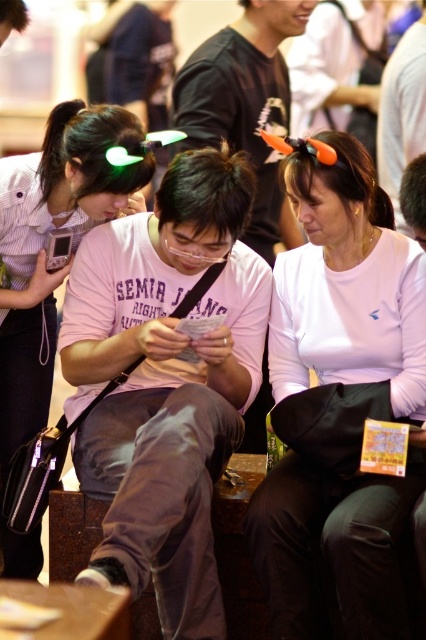
You are a photographer taking a picture of the scene. You notice two points in the image at coordinates point (425, 292) and point (97, 148). Which point is closer to the camera?

Point (97, 148) is closer to the camera because the description states that point (425, 292) is further away from the camera than point (97, 148).

You are a photographer trying to capture a clear shot of the matte pink shirt at center without the white matte hairband at upper center blocking it. What adjustment could you make to your camera angle?

The white matte hairband at upper center is in front of the matte pink shirt at center, so you should lower your camera angle to position it below the hairband and still capture the shirt.

From the picture: You are a photographer trying to capture a candid shot of the matte pink shirt at center and the white matte hairband at upper center. Which object should you focus on first if you want to ensure both are in the frame?

The white matte hairband at upper center is positioned on the right side of the matte pink shirt at center, so you should focus on the matte pink shirt at center first to ensure both are in the frame.